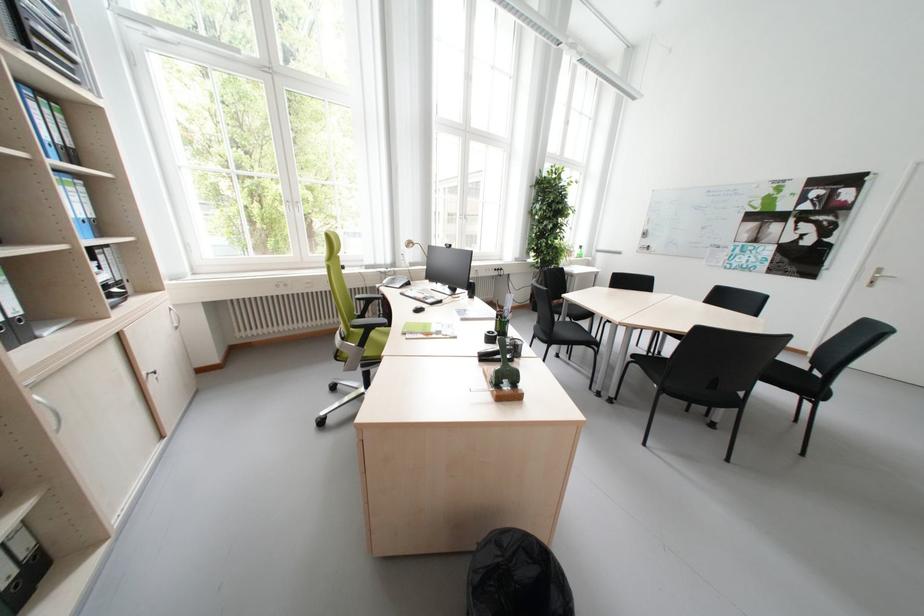
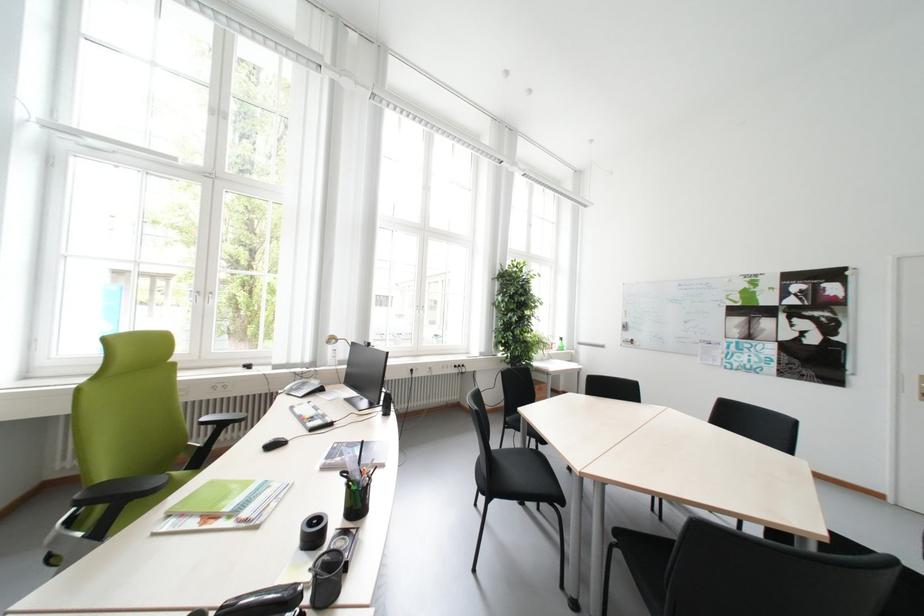
Where in the second image is the point corresponding to [423,309] from the first image?

(277, 442)